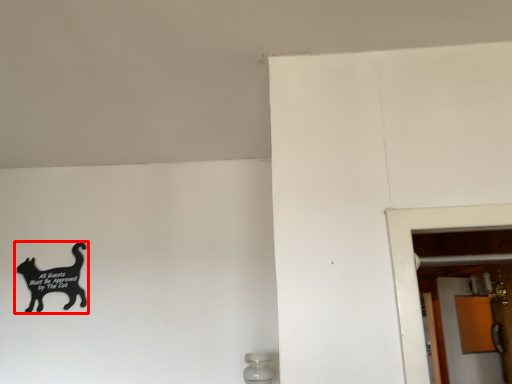
Question: From the image's perspective, considering the relative positions of cat (annotated by the red box) and screen door in the image provided, where is cat (annotated by the red box) located with respect to the staircase?

Choices:
 (A) above
 (B) below

Answer: (A)